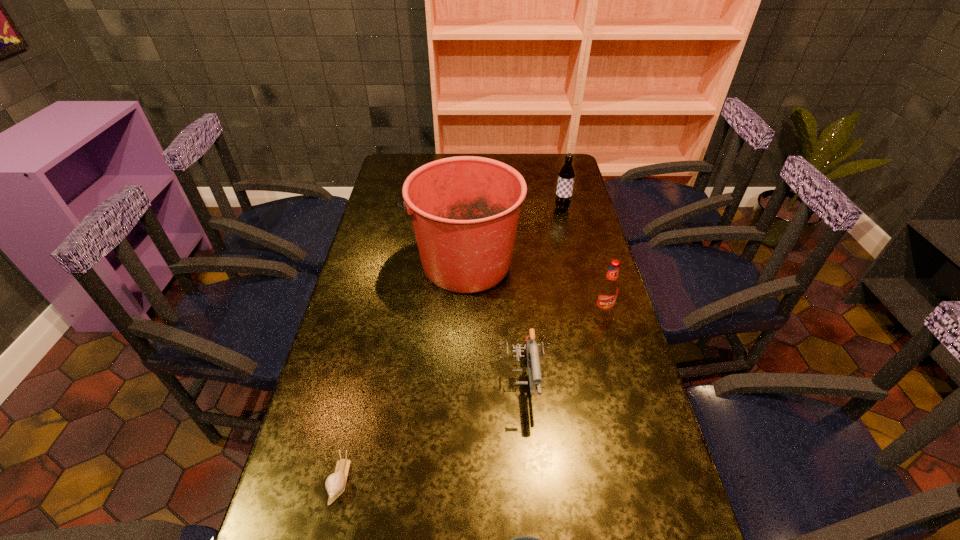
Where is `the tallest object`? Image resolution: width=960 pixels, height=540 pixels. the tallest object is located at coordinates (465, 210).

Locate an element on the screen. This screenshot has width=960, height=540. the fifth nearest object is located at coordinates (465, 210).

Where is `the farthest object`? The image size is (960, 540). the farthest object is located at coordinates (566, 175).

You are a GUI agent. You are given a task and a screenshot of the screen. Output one action in this format:
    pyautogui.click(x=<x>, y=<y>)
    Task: Click on the third farthest object
    
    Given the screenshot: What is the action you would take?
    [x=608, y=289]

Identify the location of the fourth farthest object. (530, 349).

Locate an element on the screen. This screenshot has width=960, height=540. the third shortest object is located at coordinates (530, 349).

Image resolution: width=960 pixels, height=540 pixels. I want to click on escargot, so click(x=335, y=483).

The height and width of the screenshot is (540, 960). What are the coordinates of `the fifth farthest object` in the screenshot? It's located at (335, 483).

You are a GUI agent. You are given a task and a screenshot of the screen. Output one action in this format:
    pyautogui.click(x=<x>, y=<y>)
    Task: Click on the vacant space located 0.200m on the front of the bucket
    This screenshot has height=540, width=960.
    Given the screenshot: What is the action you would take?
    pyautogui.click(x=461, y=356)

Where is `vacant region located on the front of the farthest object`? vacant region located on the front of the farthest object is located at coordinates [x=580, y=282].